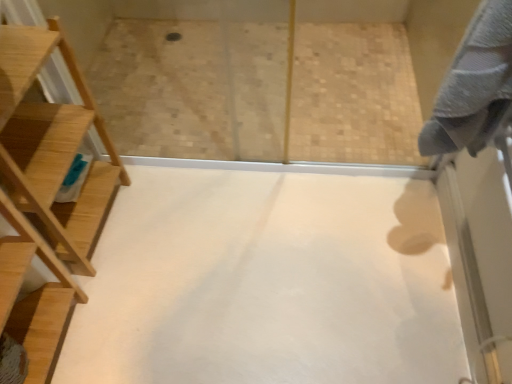
Locate an element on the screen. Image resolution: width=512 pixels, height=384 pixels. natural wood ladder at left is located at coordinates (52, 147).

What is the approximate width of gray cotton bath towel at upper right?

gray cotton bath towel at upper right is 17.65 centimeters in width.

The height and width of the screenshot is (384, 512). Identify the location of natural wood ladder at left. (52, 147).

From a real-world perspective, which is physically above, natural wood ladder at left or white matte floor at center?

natural wood ladder at left, from a real-world perspective.

From the picture: Considering the sizes of objects natural wood ladder at left and white matte floor at center in the image provided, who is shorter, natural wood ladder at left or white matte floor at center?

With less height is white matte floor at center.

Is natural wood ladder at left positioned with its back to white matte floor at center?

natural wood ladder at left is not turned away from white matte floor at center.

Based on the photo, does natural wood ladder at left have a smaller size compared to white matte floor at center?

Incorrect, natural wood ladder at left is not smaller in size than white matte floor at center.

Does white matte floor at center have a greater height compared to gray cotton bath towel at upper right?

No.

Does white matte floor at center appear on the left side of gray cotton bath towel at upper right?

Yes, white matte floor at center is to the left of gray cotton bath towel at upper right.

Can you confirm if white matte floor at center is smaller than gray cotton bath towel at upper right?

Yes, white matte floor at center is smaller than gray cotton bath towel at upper right.

Would you say white matte floor at center is a long distance from gray cotton bath towel at upper right?

white matte floor at center is actually quite close to gray cotton bath towel at upper right.

Is white matte floor at center thinner than natural wood ladder at left?

In fact, white matte floor at center might be wider than natural wood ladder at left.

From a real-world perspective, between white matte floor at center and natural wood ladder at left, who is vertically lower?

In real-world perspective, white matte floor at center is lower.

Is white matte floor at center positioned far away from natural wood ladder at left?

Actually, white matte floor at center and natural wood ladder at left are a little close together.

Is white matte floor at center inside the boundaries of natural wood ladder at left, or outside?

white matte floor at center is not enclosed by natural wood ladder at left.

Is gray cotton bath towel at upper right in front of or behind white matte floor at center in the image?

gray cotton bath towel at upper right is in front of white matte floor at center.

Is gray cotton bath towel at upper right bigger than white matte floor at center?

Yes.

Based on the photo, from the image's perspective, is gray cotton bath towel at upper right on top of white matte floor at center?

Correct, gray cotton bath towel at upper right appears higher than white matte floor at center in the image.

Considering the relative sizes of natural wood ladder at left and gray cotton bath towel at upper right in the image provided, is natural wood ladder at left thinner than gray cotton bath towel at upper right?

No, natural wood ladder at left is not thinner than gray cotton bath towel at upper right.

Is natural wood ladder at left to the left of gray cotton bath towel at upper right from the viewer's perspective?

Yes.

Between natural wood ladder at left and gray cotton bath towel at upper right, which one has more height?

natural wood ladder at left.

In the image, there is a gray cotton bath towel at upper right. Find the location of `furniture below it (from a real-world perspective)`. furniture below it (from a real-world perspective) is located at coordinates (52, 147).

From a real-world perspective, is gray cotton bath towel at upper right located higher than natural wood ladder at left?

Yes, from a real-world perspective, gray cotton bath towel at upper right is over natural wood ladder at left

Looking at their sizes, would you say gray cotton bath towel at upper right is wider or thinner than natural wood ladder at left?

Clearly, gray cotton bath towel at upper right has less width compared to natural wood ladder at left.

Does gray cotton bath towel at upper right turn towards natural wood ladder at left?

Yes, gray cotton bath towel at upper right is oriented towards natural wood ladder at left.

From the image's perspective, which one is positioned lower, gray cotton bath towel at upper right or natural wood ladder at left?

natural wood ladder at left appears lower in the image.

Locate an element on the screen. Image resolution: width=512 pixels, height=384 pixels. furniture in front of the white matte floor at center is located at coordinates (52, 147).

You are a GUI agent. You are given a task and a screenshot of the screen. Output one action in this format:
    pyautogui.click(x=<x>, y=<y>)
    Task: Click on the plain behind the gray cotton bath towel at upper right
    
    Given the screenshot: What is the action you would take?
    pyautogui.click(x=267, y=283)

Which object lies further to the anchor point gray cotton bath towel at upper right, natural wood ladder at left or white matte floor at center?

natural wood ladder at left is positioned further to the anchor gray cotton bath towel at upper right.

Considering their positions, is white matte floor at center positioned further to natural wood ladder at left than gray cotton bath towel at upper right?

Among the two, gray cotton bath towel at upper right is located further to natural wood ladder at left.

Considering their positions, is gray cotton bath towel at upper right positioned closer to natural wood ladder at left than white matte floor at center?

white matte floor at center is positioned closer to the anchor natural wood ladder at left.

Based on their spatial positions, is natural wood ladder at left or gray cotton bath towel at upper right closer to white matte floor at center?

natural wood ladder at left lies closer to white matte floor at center than the other object.

From the image, which object appears to be nearer to white matte floor at center, gray cotton bath towel at upper right or natural wood ladder at left?

natural wood ladder at left lies closer to white matte floor at center than the other object.

Estimate the real-world distances between objects in this image. Which object is closer to gray cotton bath towel at upper right, white matte floor at center or natural wood ladder at left?

Based on the image, white matte floor at center appears to be nearer to gray cotton bath towel at upper right.

What are the coordinates of `plain situated between natural wood ladder at left and gray cotton bath towel at upper right from left to right` in the screenshot? It's located at (267, 283).